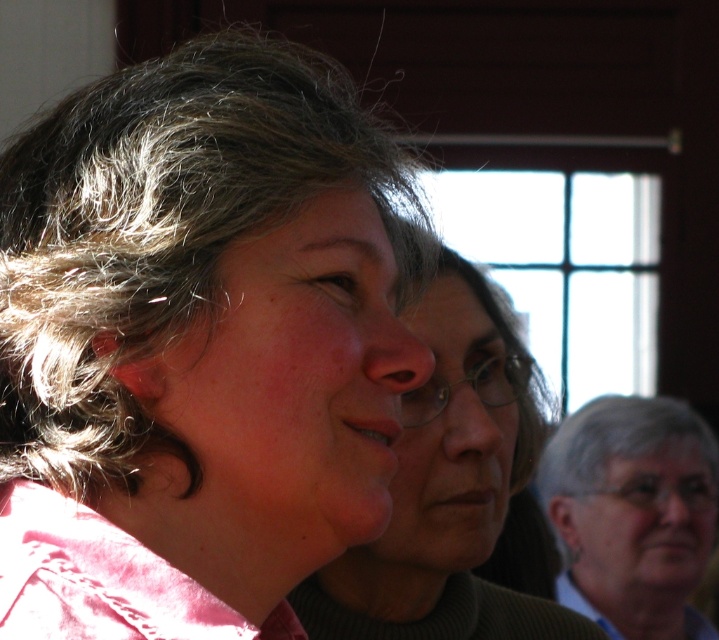
Is gray curly hair at center above matte pink shirt at center?

Yes.

Is point (191, 205) more distant than point (457, 614)?

No, (191, 205) is in front of (457, 614).

Identify the location of gray curly hair at center. (155, 232).